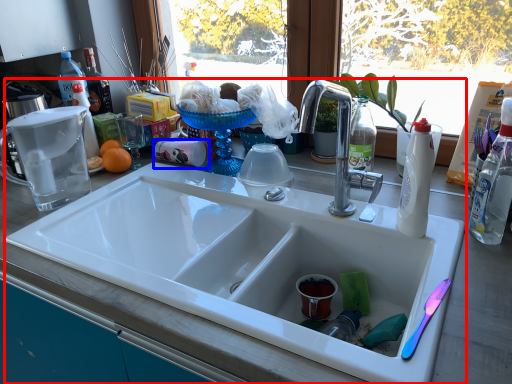
Question: Among these objects, which one is farthest to the camera, sink (highlighted by a red box) or coffee cup (highlighted by a blue box)?

Choices:
 (A) sink
 (B) coffee cup

Answer: (B)